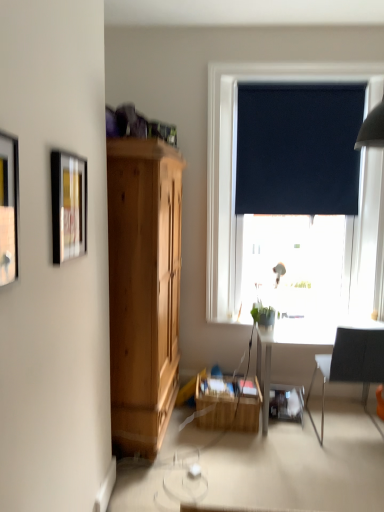
Question: From a real-world perspective, is black fabric curtain at upper right positioned above or below wooden crate at center?

Choices:
 (A) above
 (B) below

Answer: (A)

Question: From the image's perspective, is black fabric curtain at upper right located above or below wooden crate at center?

Choices:
 (A) above
 (B) below

Answer: (A)

Question: Considering the real-world distances, which object is farthest from the matte black picture frame at left, the second picture frame from the back?

Choices:
 (A) metallic silver picture frame at upper left, which is counted as the second picture frame, starting from the front
 (B) black fabric chair at right
 (C) black roller blind at upper right
 (D) wooden crate at center
 (E) black fabric curtain at upper right

Answer: (E)

Question: Based on their relative distances, which object is nearer to the matte black picture frame at left, the second picture frame from the back?

Choices:
 (A) black fabric curtain at upper right
 (B) wooden crate at center
 (C) black roller blind at upper right
 (D) green matte plant at lower center
 (E) black fabric chair at right

Answer: (D)